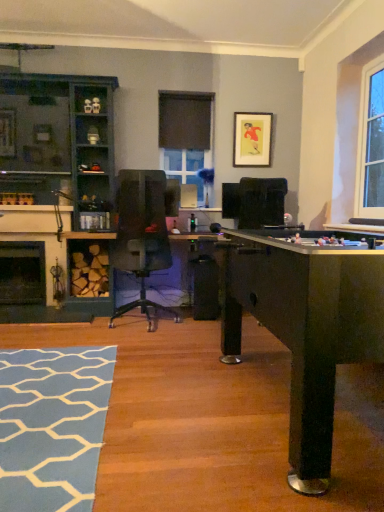
Image resolution: width=384 pixels, height=512 pixels. Describe the element at coordinates (185, 168) in the screenshot. I see `transparent glass window screen at center` at that location.

Where is `black matte fireplace at lower left, which is the second fireplace in back-to-front order`? black matte fireplace at lower left, which is the second fireplace in back-to-front order is located at coordinates (37, 238).

Identify the location of black stone fireplace at lower left, which appears as the second fireplace when viewed from the front. (22, 273).

Identify the location of picture frame on the right of blue textured rug at lower left. The height and width of the screenshot is (512, 384). (252, 139).

Is blue textured rug at lower left shorter than matte gold picture frame at upper center?

Yes.

How many degrees apart are the facing directions of blue textured rug at lower left and matte gold picture frame at upper center?

There is a 0.832-degree angle between the facing directions of blue textured rug at lower left and matte gold picture frame at upper center.

Between blue textured rug at lower left and matte gold picture frame at upper center, which one has larger size?

Bigger between the two is blue textured rug at lower left.

From a real-world perspective, which object stands above the other?

matte gold picture frame at upper center.

How far apart are teal wood cabinet at left and matte gold picture frame at upper center?

teal wood cabinet at left is 1.68 meters from matte gold picture frame at upper center.

From the image's perspective, is teal wood cabinet at left below matte gold picture frame at upper center?

Correct, teal wood cabinet at left appears lower than matte gold picture frame at upper center in the image.

In terms of size, does teal wood cabinet at left appear bigger or smaller than matte gold picture frame at upper center?

Considering their sizes, teal wood cabinet at left takes up more space than matte gold picture frame at upper center.

Does point (57, 474) come farther from viewer compared to point (31, 274)?

That is False.

From a real-world perspective, is blue textured rug at lower left positioned over black stone fireplace at lower left, which appears as the second fireplace when viewed from the front, based on gravity?

No, from a real-world perspective, blue textured rug at lower left is not on top of black stone fireplace at lower left, which appears as the second fireplace when viewed from the front.

From the picture: Can you confirm if blue textured rug at lower left is positioned to the right of black stone fireplace at lower left, which is the first fireplace in back-to-front order?

Correct, you'll find blue textured rug at lower left to the right of black stone fireplace at lower left, which is the first fireplace in back-to-front order.

Is blue textured rug at lower left facing away from black stone fireplace at lower left, which is the first fireplace in back-to-front order?

blue textured rug at lower left does not have its back to black stone fireplace at lower left, which is the first fireplace in back-to-front order.

Is black stone fireplace at lower left, which appears as the second fireplace when viewed from the front, behind transparent glass window screen at center?

No, black stone fireplace at lower left, which appears as the second fireplace when viewed from the front, is in front of transparent glass window screen at center.

How many degrees apart are the facing directions of black stone fireplace at lower left, which is the first fireplace in back-to-front order, and transparent glass window screen at center?

They differ by 0.00435 degrees in their facing directions.

How distant is black stone fireplace at lower left, which appears as the second fireplace when viewed from the front, from transparent glass window screen at center?

They are 1.75 meters apart.

Who is bigger, black stone fireplace at lower left, which appears as the second fireplace when viewed from the front, or transparent glass window screen at center?

Bigger between the two is black stone fireplace at lower left, which appears as the second fireplace when viewed from the front.

Could you tell me if blue textured rug at lower left is turned towards black matte fireplace at lower left, placed as the 1th fireplace when sorted from front to back?

No, blue textured rug at lower left is not oriented towards black matte fireplace at lower left, placed as the 1th fireplace when sorted from front to back.

Where is `the 1st fireplace counting from the left of the blue textured rug at lower left`? the 1st fireplace counting from the left of the blue textured rug at lower left is located at coordinates (37, 238).

Which is behind, point (72, 444) or point (61, 240)?

Point (61, 240)

Based on the photo, what's the angular difference between black matte fireplace at lower left, which is the second fireplace in back-to-front order, and transparent glass window screen at center's facing directions?

There is a 0.00336-degree angle between the facing directions of black matte fireplace at lower left, which is the second fireplace in back-to-front order, and transparent glass window screen at center.

Is point (53, 207) closer to camera compared to point (168, 163)?

Yes, it is.

Consider the image. In terms of height, does black matte fireplace at lower left, which is the second fireplace in back-to-front order, look taller or shorter compared to transparent glass window screen at center?

Clearly, black matte fireplace at lower left, which is the second fireplace in back-to-front order, is taller compared to transparent glass window screen at center.

Is matte gold picture frame at upper center directly adjacent to teal wood cabinet at left?

No, matte gold picture frame at upper center is not touching teal wood cabinet at left.

Who is smaller, matte gold picture frame at upper center or teal wood cabinet at left?

matte gold picture frame at upper center.

Is matte gold picture frame at upper center to the left or to the right of teal wood cabinet at left in the image?

Based on their positions, matte gold picture frame at upper center is located to the right of teal wood cabinet at left.

Considering the sizes of objects matte gold picture frame at upper center and teal wood cabinet at left in the image provided, who is shorter, matte gold picture frame at upper center or teal wood cabinet at left?

matte gold picture frame at upper center is shorter.

This screenshot has height=512, width=384. In the image, there is a matte gold picture frame at upper center. In order to click on flat below it (from the image's perspective) in this screenshot , I will do `click(52, 426)`.

Locate an element on the screen. The height and width of the screenshot is (512, 384). picture frame on the right of teal wood cabinet at left is located at coordinates (252, 139).

Considering their positions, is matte gold picture frame at upper center positioned further to black matte fireplace at lower left, placed as the 1th fireplace when sorted from front to back, than transparent glass window screen at center?

The object further to black matte fireplace at lower left, placed as the 1th fireplace when sorted from front to back, is matte gold picture frame at upper center.

From the image, which object appears to be nearer to blue textured rug at lower left, black stone fireplace at lower left, which is the first fireplace in back-to-front order, or transparent glass window screen at center?

black stone fireplace at lower left, which is the first fireplace in back-to-front order, lies closer to blue textured rug at lower left than the other object.

Estimate the real-world distances between objects in this image. Which object is further from teal wood cabinet at left, transparent glass window screen at center or black stone fireplace at lower left, which is the first fireplace in back-to-front order?

transparent glass window screen at center is positioned further to the anchor teal wood cabinet at left.

Looking at the image, which one is located closer to matte gold picture frame at upper center, black matte fireplace at lower left, placed as the 1th fireplace when sorted from front to back, or transparent glass window screen at center?

transparent glass window screen at center is closer to matte gold picture frame at upper center.

From the image, which object appears to be farther from matte gold picture frame at upper center, blue textured rug at lower left or black matte fireplace at lower left, placed as the 1th fireplace when sorted from front to back?

blue textured rug at lower left lies further to matte gold picture frame at upper center than the other object.

Looking at the image, which one is located closer to matte gold picture frame at upper center, black stone fireplace at lower left, which is the first fireplace in back-to-front order, or blue textured rug at lower left?

black stone fireplace at lower left, which is the first fireplace in back-to-front order, lies closer to matte gold picture frame at upper center than the other object.

In the scene shown: Looking at the image, which one is located closer to transparent glass window screen at center, matte gold picture frame at upper center or black matte fireplace at lower left, placed as the 1th fireplace when sorted from front to back?

matte gold picture frame at upper center is closer to transparent glass window screen at center.

From the image, which object appears to be nearer to matte gold picture frame at upper center, black stone fireplace at lower left, which is the first fireplace in back-to-front order, or transparent glass window screen at center?

transparent glass window screen at center.

Locate an element on the screen. The width and height of the screenshot is (384, 512). cabinetry between blue textured rug at lower left and transparent glass window screen at center along the z-axis is located at coordinates (58, 142).

I want to click on cabinetry between blue textured rug at lower left and black stone fireplace at lower left, which is the first fireplace in back-to-front order, in the front-back direction, so click(58, 142).

Identify the location of fireplace located between black stone fireplace at lower left, which appears as the second fireplace when viewed from the front, and matte gold picture frame at upper center in the left-right direction. The width and height of the screenshot is (384, 512). (37, 238).

Where is `fireplace situated between black stone fireplace at lower left, which is the first fireplace in back-to-front order, and transparent glass window screen at center from left to right`? The width and height of the screenshot is (384, 512). fireplace situated between black stone fireplace at lower left, which is the first fireplace in back-to-front order, and transparent glass window screen at center from left to right is located at coordinates (37, 238).